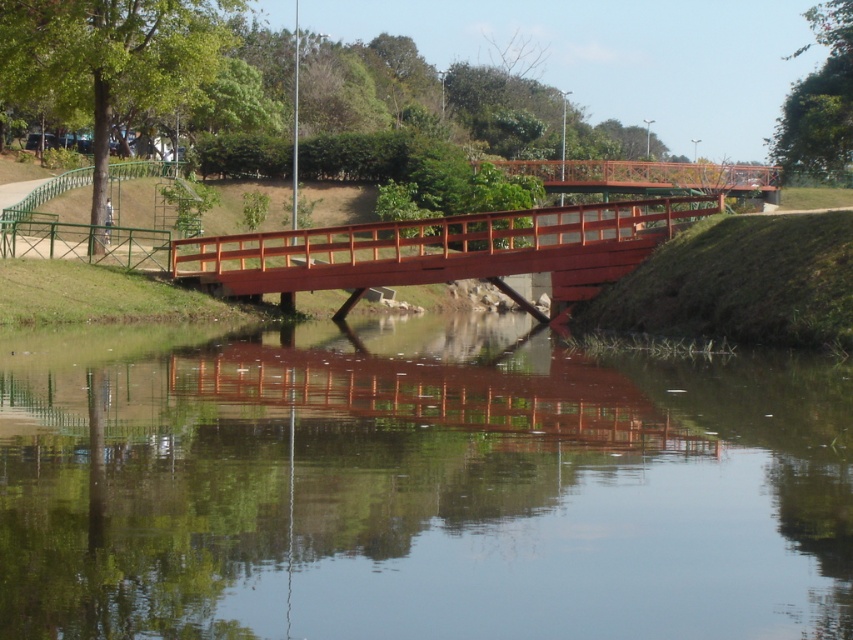
You are a painter standing on the grassy area near the water. You want to paint the scene focusing on the smooth brown water at center and the smooth wooden bridge at center. Which object should you include more of in your painting if you want to emphasize their actual sizes?

You should include more of the smooth brown water at center in your painting because its width is larger than the smooth wooden bridge at center, making it visually dominant in the scene.

Based on the photo, you are standing on the red pedestrian bridge and looking towards the water. There are two points marked on the bridge deck. Which point, point (x=485, y=220) or point (x=769, y=179), is closer to you?

Point (x=485, y=220) is closer to you than point (x=769, y=179) because it is nearer in the scene.

You are standing on the grassy area near the water and want to cross to the other side. There are two bridges in the scene, the smooth wooden bridge at center and the rustic wood bridge at center. Which bridge should you approach first to reach the closest one?

The smooth wooden bridge at center is closer to the viewer than rustic wood bridge at center, so you should approach the smooth wooden bridge at center first to reach the closest one.